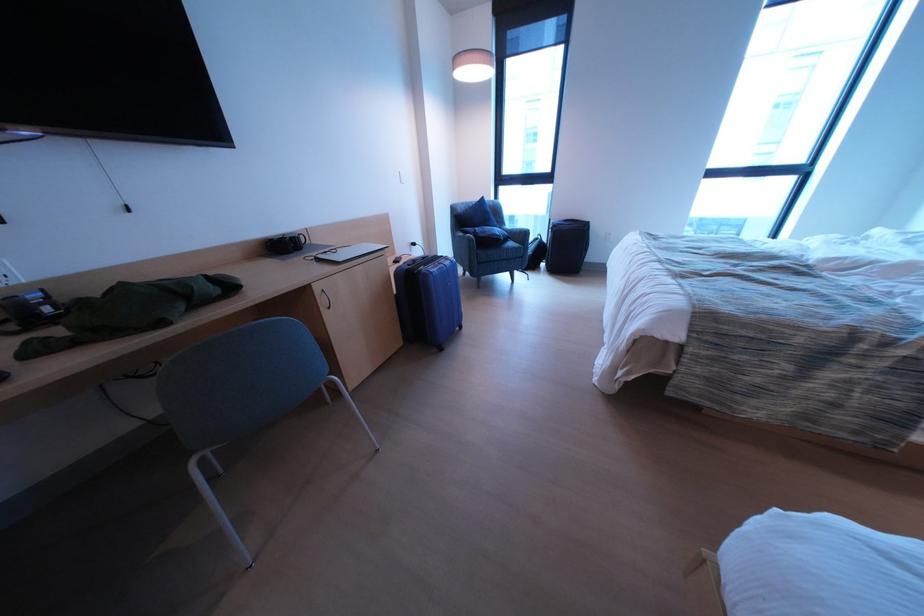
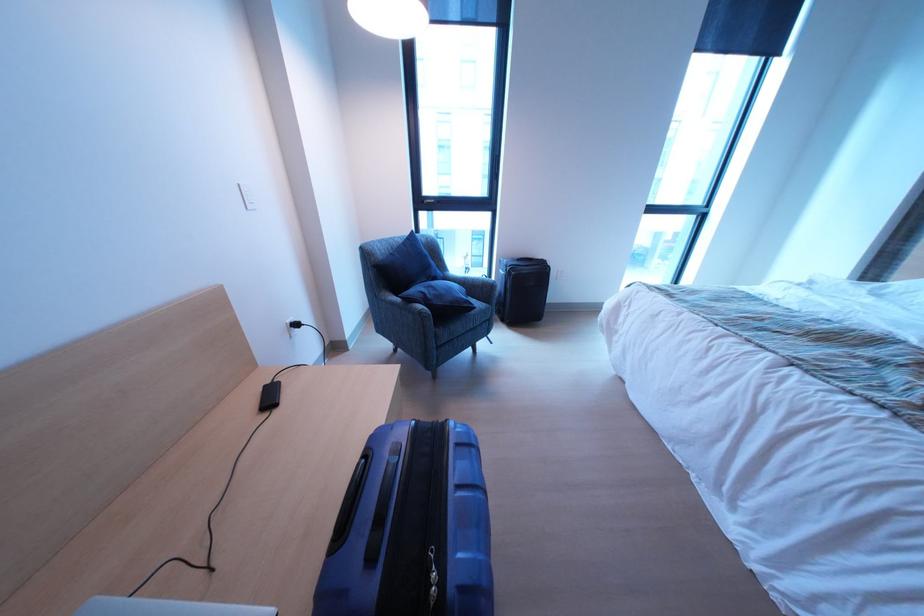
Question: In a continuous first-person perspective shot, in which direction is the camera moving?

Choices:
 (A) Left
 (B) Right
 (C) Forward
 (D) Backward

Answer: (C)